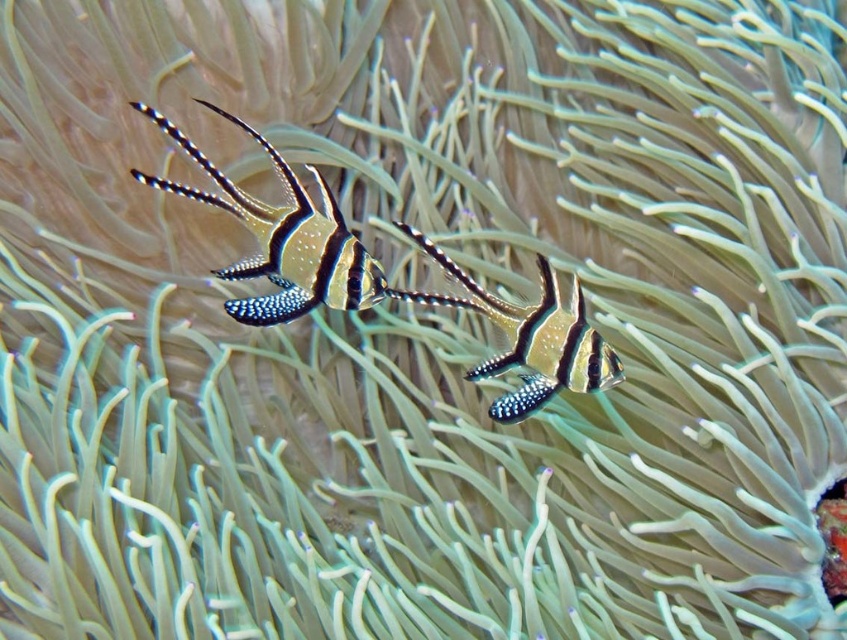
Question: Where is black and white striped fish at left located in relation to black and white striped fish at center in the image?

Choices:
 (A) left
 (B) right

Answer: (A)

Question: Among these objects, which one is farthest from the camera?

Choices:
 (A) black and white striped fish at left
 (B) black and white striped fish at center

Answer: (B)

Question: Is black and white striped fish at left closer to camera compared to black and white striped fish at center?

Choices:
 (A) no
 (B) yes

Answer: (B)

Question: From the image, what is the correct spatial relationship of black and white striped fish at left in relation to black and white striped fish at center?

Choices:
 (A) below
 (B) above

Answer: (B)